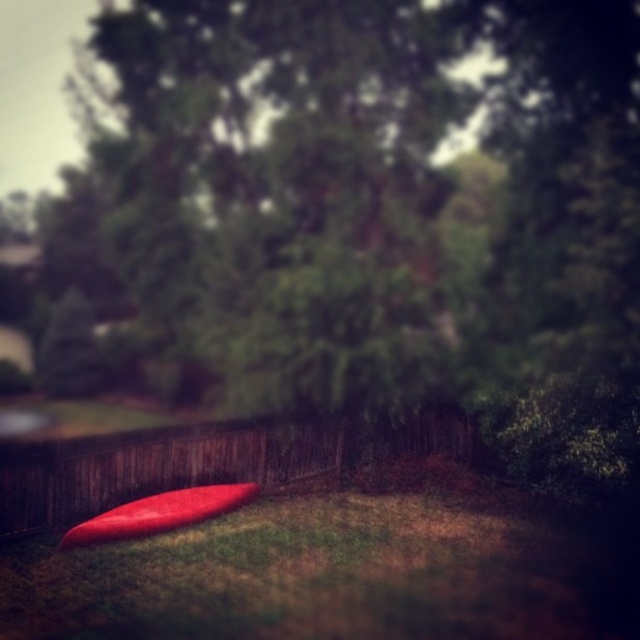
Which of these two, wooden fence at lower left or glossy red surfboard at center, stands shorter?

glossy red surfboard at center

Who is lower down, wooden fence at lower left or glossy red surfboard at center?

glossy red surfboard at center

Which is in front, point (163, 484) or point (141, 500)?

Positioned in front is point (141, 500).

The image size is (640, 640). Identify the location of wooden fence at lower left. (204, 460).